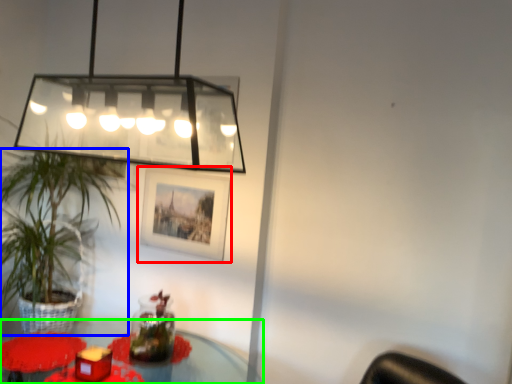
Question: Considering the real-world distances, which object is farthest from picture frame (highlighted by a red box)? houseplant (highlighted by a blue box) or table (highlighted by a green box)?

Choices:
 (A) houseplant
 (B) table

Answer: (B)